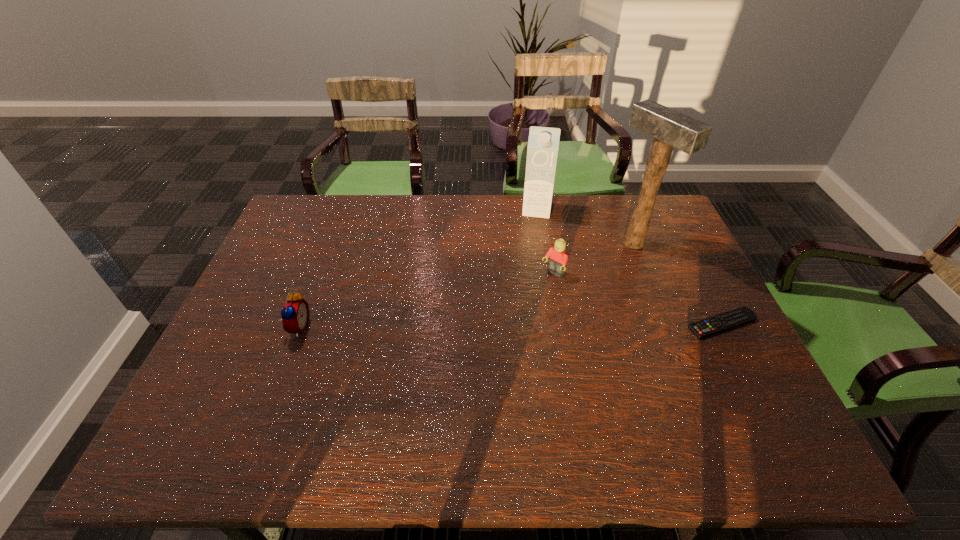
Where is `object that is at the left edge`? object that is at the left edge is located at coordinates (295, 315).

Where is `remote control at the right edge`? remote control at the right edge is located at coordinates (741, 316).

Locate an element on the screen. mallet at the right edge is located at coordinates (670, 128).

In order to click on object present at the far right corner in this screenshot , I will do `click(670, 128)`.

In the image, there is a desktop. Identify the location of vacant space at the far edge. Image resolution: width=960 pixels, height=540 pixels. (487, 226).

I want to click on free space at the near edge of the desktop, so click(x=688, y=404).

Locate an element on the screen. The image size is (960, 540). vacant region at the left edge of the desktop is located at coordinates (269, 294).

The image size is (960, 540). What are the coordinates of `free spot at the right edge of the desktop` in the screenshot? It's located at (722, 363).

The image size is (960, 540). What are the coordinates of `free space at the far left corner of the desktop` in the screenshot? It's located at (338, 195).

The image size is (960, 540). What are the coordinates of `free space between the third nearest object and the shortest object` in the screenshot? It's located at (637, 299).